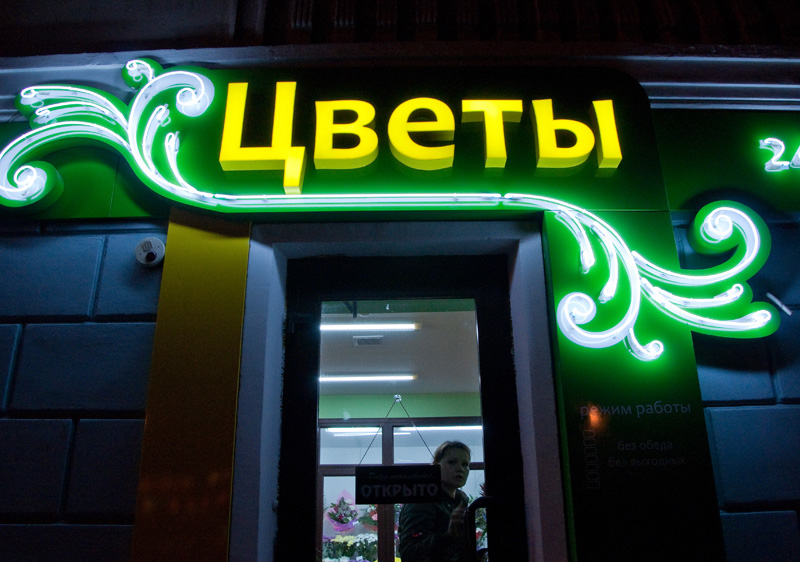
This screenshot has width=800, height=562. I want to click on neon lit logo, so tap(132, 126), tap(634, 279).